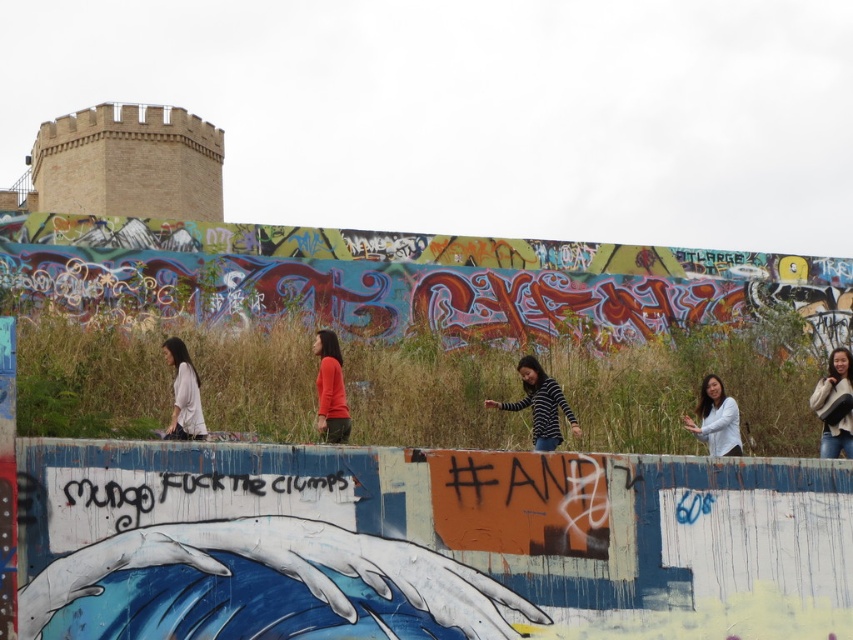
Does striped sweater at center appear under matte orange sweater at center?

Correct, striped sweater at center is located below matte orange sweater at center.

Does striped sweater at center have a greater width compared to matte orange sweater at center?

In fact, striped sweater at center might be narrower than matte orange sweater at center.

Which is in front, point (576, 428) or point (341, 412)?

Point (341, 412)

This screenshot has width=853, height=640. In order to click on striped sweater at center in this screenshot , I will do `click(540, 404)`.

Who is more distant from viewer, [827,422] or [532,378]?

The point [532,378] is more distant.

What do you see at coordinates (834, 404) in the screenshot? The height and width of the screenshot is (640, 853). I see `white sweater at upper right` at bounding box center [834, 404].

Does point (827, 396) lie in front of point (537, 404)?

No, (827, 396) is behind (537, 404).

The image size is (853, 640). What are the coordinates of `white sweater at upper right` in the screenshot? It's located at (834, 404).

Consider the image. Between white sweater at upper right and matte orange sweater at center, which one has more height?

white sweater at upper right

Is white sweater at upper right further to camera compared to matte orange sweater at center?

Yes, white sweater at upper right is behind matte orange sweater at center.

Where is `white sweater at upper right`? This screenshot has height=640, width=853. white sweater at upper right is located at coordinates 834,404.